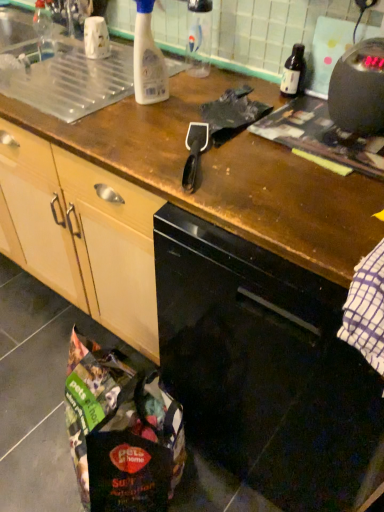
Question: Which is correct: transparent plastic sink at upper center is inside transparent plastic bottle at upper center, which appears as the second bottle when viewed from the right, or outside of it?

Choices:
 (A) inside
 (B) outside

Answer: (B)

Question: In terms of size, does transparent plastic sink at upper center appear bigger or smaller than transparent plastic bottle at upper center, which appears as the second bottle when viewed from the right?

Choices:
 (A) big
 (B) small

Answer: (A)

Question: Estimate the real-world distances between objects in this image. Which object is closer to the black plastic spatula at center?

Choices:
 (A) transparent plastic sink at upper center
 (B) black plastic kettle at upper right
 (C) black glossy dishwasher at center
 (D) translucent plastic spray bottle at upper center, arranged as the third bottle when viewed from the right
 (E) transparent plastic bottle at upper center, which appears as the second bottle when viewed from the right

Answer: (D)

Question: Based on their relative distances, which object is farther from the translucent plastic spray bottle at upper center, arranged as the first bottle when viewed from the left?

Choices:
 (A) transparent plastic bottle at upper center, the 2th bottle from the left
 (B) transparent plastic sink at upper center
 (C) translucent glass bottle at upper right, placed as the 3th bottle when sorted from left to right
 (D) black plastic kettle at upper right
 (E) black plastic spatula at center

Answer: (D)